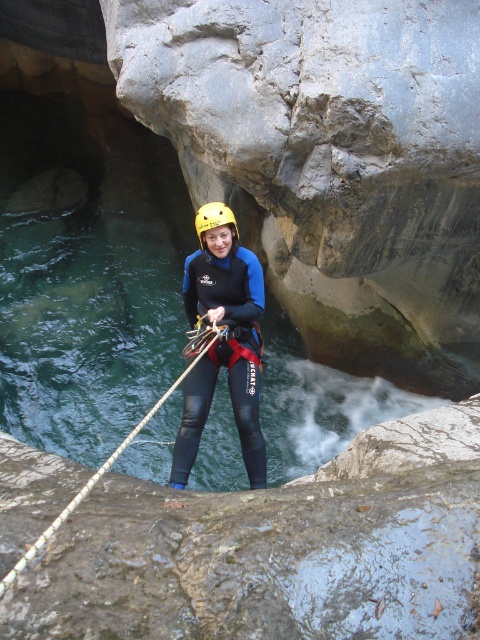
You are a canyoning guide assessing the rappelling setup. The participant is holding the roperoughrope at center. Based on the coordinates provided, is the rope positioned correctly for a safe rappel? Please explain using the given coordinates.

The roperoughrope at center is located at point coordinates. To determine if it is positioned correctly for a safe rappel, the coordinates must align with the designated anchor point. However, without knowing the canyon wall layout or the anchor point coordinates, it is impossible to confirm the rope position solely from the given coordinates.

You are a safety inspector reviewing the canyoning setup. You notice a point marked at coordinates (223, 340). What object is located at that point?

The point at coordinates (223, 340) indicates the matte black wetsuit at center.